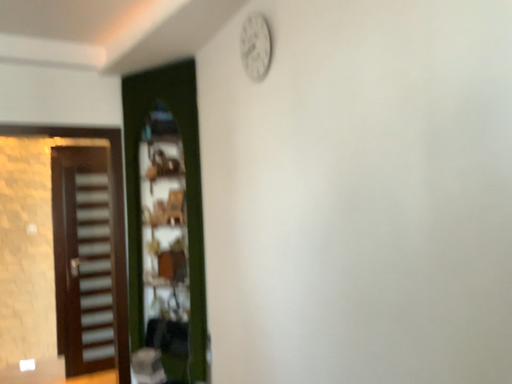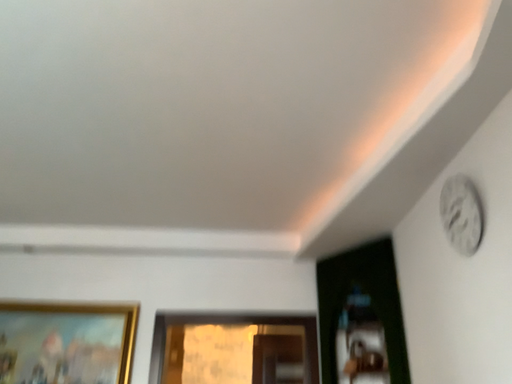
Question: Which way did the camera rotate in the video?

Choices:
 (A) rotated left
 (B) rotated right

Answer: (A)